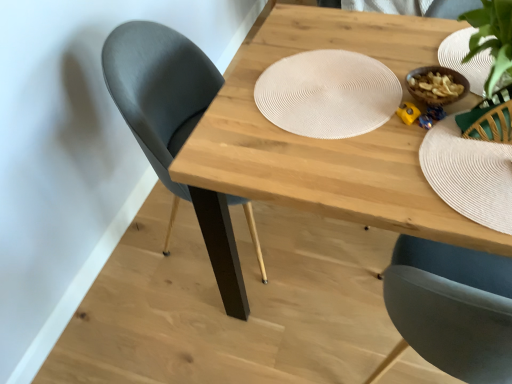
Question: From the image's perspective, relative to white woven placemat at center, is matte black chair at left above or below?

Choices:
 (A) below
 (B) above

Answer: (A)

Question: In terms of size, does matte black chair at left appear bigger or smaller than white woven placemat at center?

Choices:
 (A) small
 (B) big

Answer: (B)

Question: Estimate the real-world distances between objects in this image. Which object is farther from the matte black chair at left?

Choices:
 (A) natural wood table at center
 (B) white woven placemat at center
 (C) white textured paper plate at upper right

Answer: (C)

Question: Which is farther from the white woven placemat at center?

Choices:
 (A) natural wood table at center
 (B) white textured paper plate at upper right
 (C) matte black chair at left

Answer: (C)